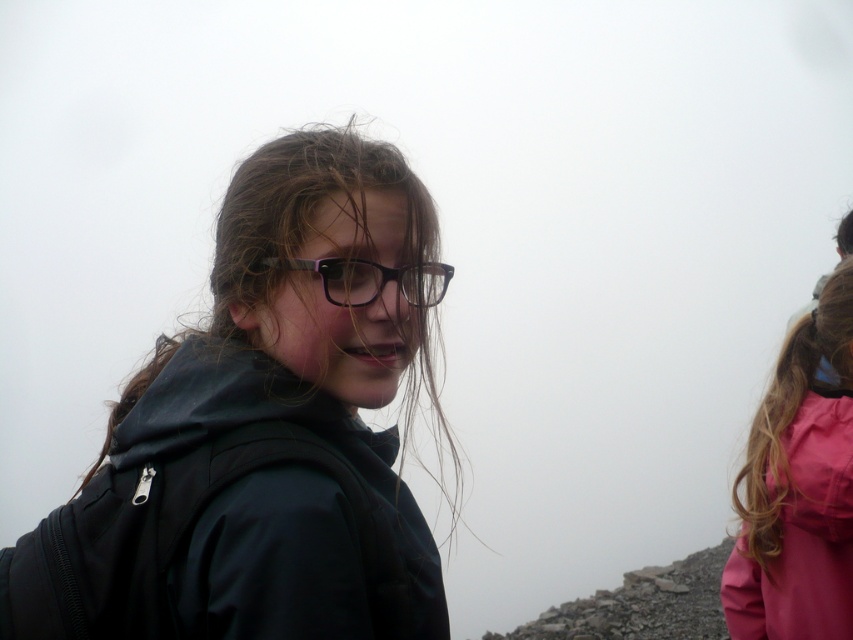
You are planning to buy a jacket for your friend who prefers a larger size. Based on the image, which jacket would be more suitable between the matte black jacket at center and the pink matte jacket at right?

The matte black jacket at center has a larger size compared to the pink matte jacket at right, so it would be more suitable for your friend who prefers a larger size.

You are planning to take a photo of the two hikers, the matte black jacket at center and the pink matte jacket at right. To ensure both are fully visible in the frame, which jacket should be closer to the camera?

The matte black jacket at center is shorter than the pink matte jacket at right, so to ensure both are fully visible in the frame, the matte black jacket at center should be positioned closer to the camera.

You are a hiker who wants to place a small marker at point (260, 435). Which object in the image should you place it on?

The point (260, 435) is on the matte black jacket at center, so you should place the marker there.